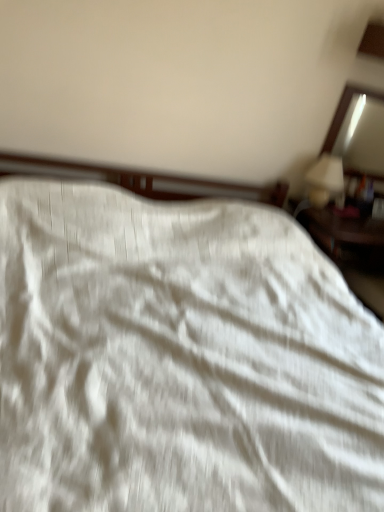
Question: From a real-world perspective, is matte wooden mirror at upper right positioned under white glossy table lamp at upper right based on gravity?

Choices:
 (A) yes
 (B) no

Answer: (B)

Question: Would you say white glossy table lamp at upper right is part of matte wooden mirror at upper right's contents?

Choices:
 (A) yes
 (B) no

Answer: (B)

Question: Is matte wooden mirror at upper right at the right side of white glossy table lamp at upper right?

Choices:
 (A) yes
 (B) no

Answer: (A)

Question: Is matte wooden mirror at upper right at the left side of white glossy table lamp at upper right?

Choices:
 (A) yes
 (B) no

Answer: (B)

Question: Considering the relative positions of matte wooden mirror at upper right and white glossy table lamp at upper right in the image provided, is matte wooden mirror at upper right behind white glossy table lamp at upper right?

Choices:
 (A) no
 (B) yes

Answer: (B)

Question: In terms of height, does white glossy table lamp at upper right look taller or shorter compared to matte wooden mirror at upper right?

Choices:
 (A) short
 (B) tall

Answer: (A)

Question: Is white glossy table lamp at upper right in front of or behind matte wooden mirror at upper right in the image?

Choices:
 (A) behind
 (B) front

Answer: (B)

Question: From a real-world perspective, is white glossy table lamp at upper right above or below matte wooden mirror at upper right?

Choices:
 (A) above
 (B) below

Answer: (B)

Question: Is white glossy table lamp at upper right inside the boundaries of matte wooden mirror at upper right, or outside?

Choices:
 (A) inside
 (B) outside

Answer: (B)

Question: Would you say white textured fabric at center is to the left or to the right of matte wooden mirror at upper right in the picture?

Choices:
 (A) right
 (B) left

Answer: (B)

Question: Is white textured fabric at center wider or thinner than matte wooden mirror at upper right?

Choices:
 (A) wide
 (B) thin

Answer: (A)

Question: Is white textured fabric at center in front of or behind matte wooden mirror at upper right in the image?

Choices:
 (A) front
 (B) behind

Answer: (A)

Question: From a real-world perspective, is white textured fabric at center positioned above or below matte wooden mirror at upper right?

Choices:
 (A) above
 (B) below

Answer: (B)

Question: Considering the relative positions of white glossy table lamp at upper right and white textured fabric at center in the image provided, is white glossy table lamp at upper right to the left or to the right of white textured fabric at center?

Choices:
 (A) left
 (B) right

Answer: (B)

Question: Looking at the image, does white glossy table lamp at upper right seem bigger or smaller compared to white textured fabric at center?

Choices:
 (A) small
 (B) big

Answer: (A)